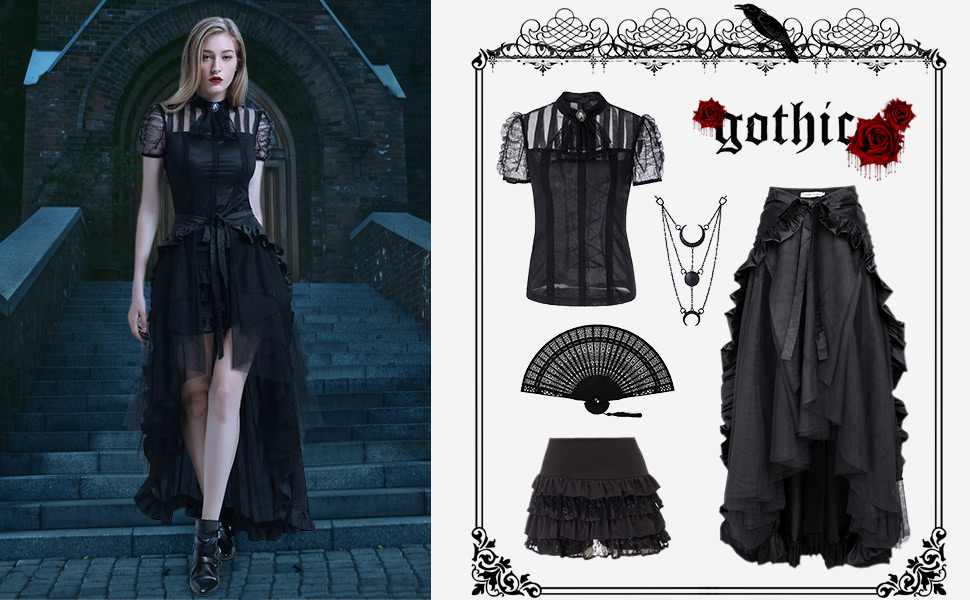
The image size is (970, 600). What are the coordinates of `stair case` in the screenshot? It's located at (370, 451).